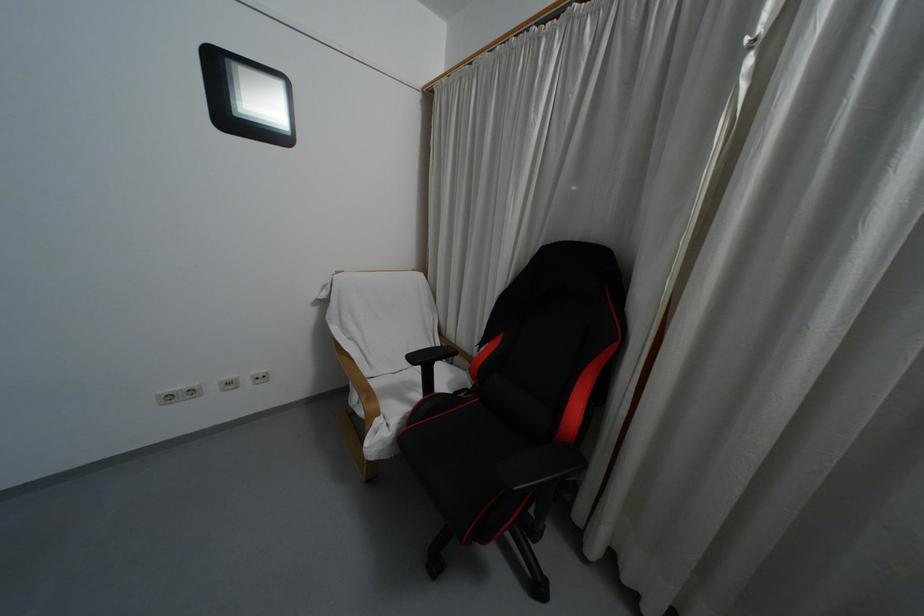
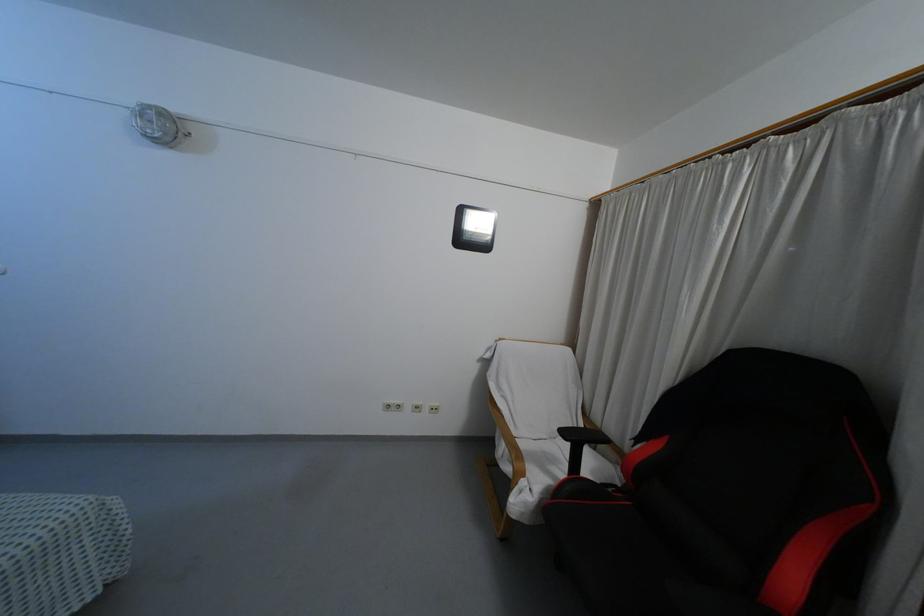
Question: The camera is either moving clockwise (left) or counter-clockwise (right) around the object. The first image is from the beginning of the video and the second image is from the end. Is the camera moving left or right when shooting the video?

Choices:
 (A) Left
 (B) Right

Answer: (B)